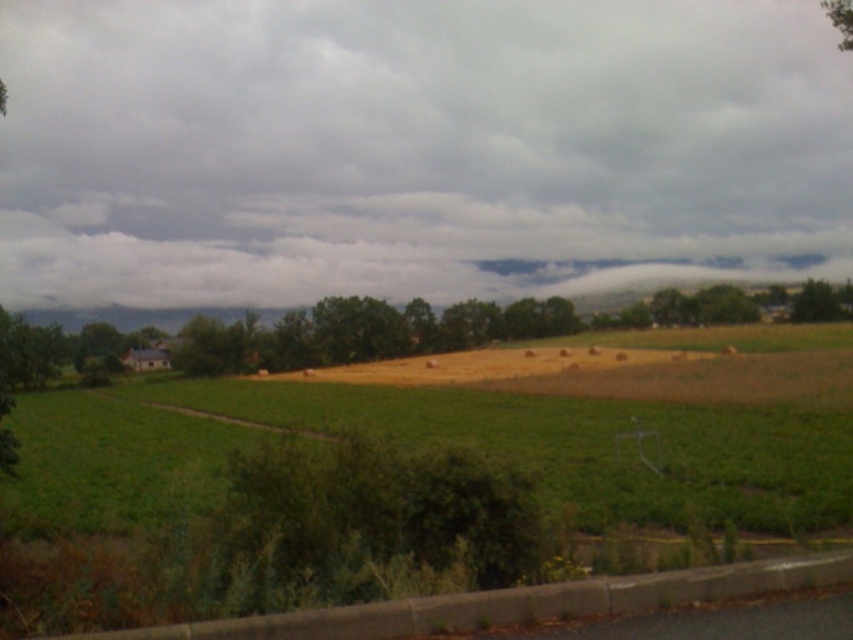
Which is in front, point (756, 188) or point (408, 340)?

Positioned in front is point (408, 340).

The height and width of the screenshot is (640, 853). Identify the location of cloudy sky at upper center. (416, 147).